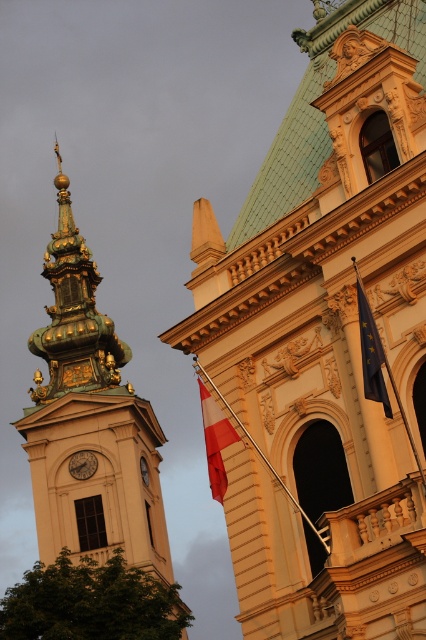
Consider the image. You are standing at the point marked by coordinates (325, 337) in the image. Which object are you closest to?

You are closest to the golden ornate tower at upper left.